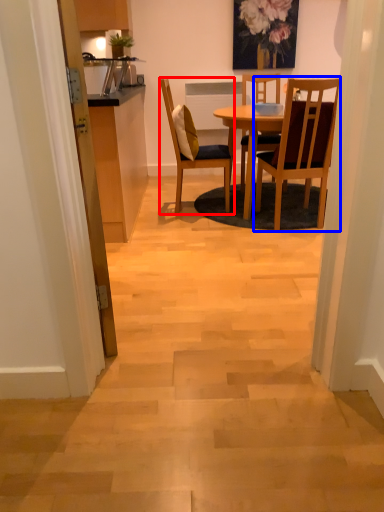
Question: Which of the following is the closest to the observer, chair (highlighted by a red box) or chair (highlighted by a blue box)?

Choices:
 (A) chair
 (B) chair

Answer: (B)